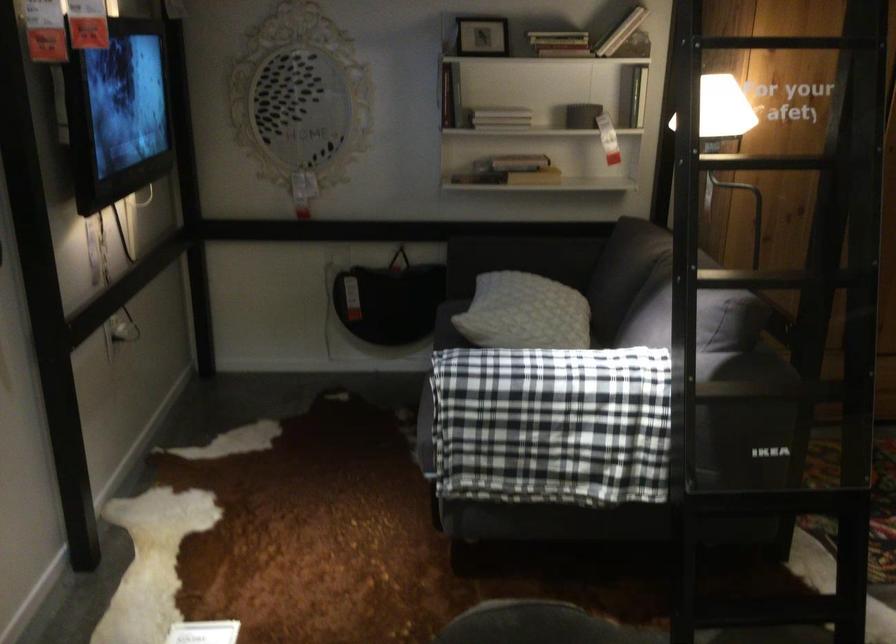
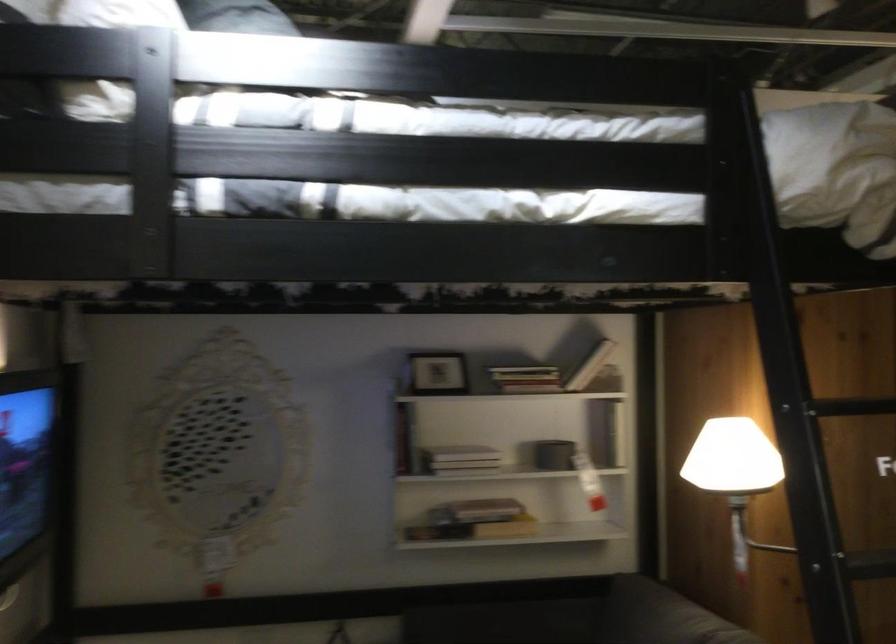
In the second image, find the point that corresponds to (x=506, y=166) in the first image.

(474, 529)